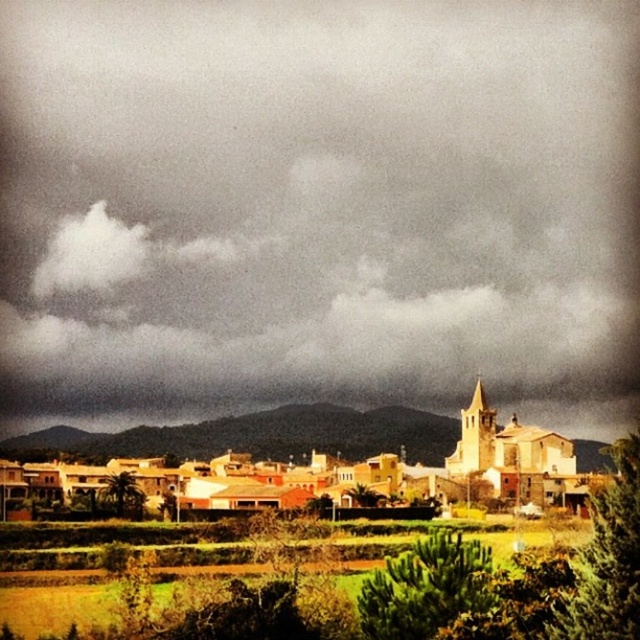
You are a weather balloon operator who needs to launch a balloon from the white stucco buildings at center. The balloon can ascend up to 50 meters. Will the balloon reach the dark gray cloud at upper center?

The distance between the dark gray cloud at upper center and the white stucco buildings at center is 43.48 meters. Since the balloon can ascend up to 50 meters, it will be able to reach the dark gray cloud at upper center.

You are an architect designing a new building in the village. You need to ensure that the new structure won t block the view of the dark gray cloud at upper center from the white stucco buildings at center. Based on the scene, what should you consider about the height of the new building?

The dark gray cloud at upper center has a greater height compared to white stucco buildings at center. To ensure the new building doesn t block the view of the cloud, the architect should design the new structure to be shorter than the white stucco buildings at center so that the cloud remains visible from their vantage point.

You are an architect designing a new residential area. You want to ensure that the white stucco buildings at center will not be overshadowed by the dark gray cloud at upper center in terms of visual prominence. Based on the scene, what factor should you consider?

The dark gray cloud at upper center is bigger than the white stucco buildings at center, so to ensure the buildings are not overshadowed, you should consider the size difference between the two elements.